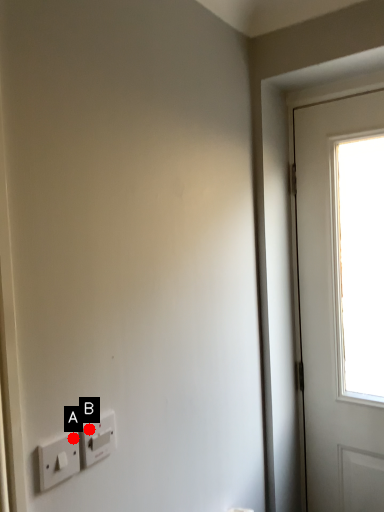
Question: Two points are circled on the image, labeled by A and B beside each circle. Which point is farther to the camera?

Choices:
 (A) A is further
 (B) B is further

Answer: (B)